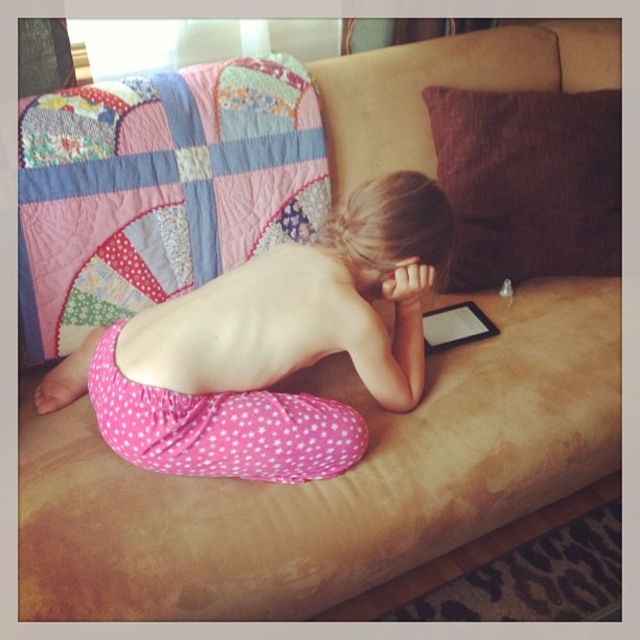
You are a furniture designer who wants to place a new decorative item between the brown cotton pillow at upper right and the pink polka dot fabric at lower center. Based on their sizes, which object should the item be placed closer to?

The brown cotton pillow at upper right is taller than the pink polka dot fabric at lower center. Therefore, the decorative item should be placed closer to the pink polka dot fabric at lower center to balance the height difference between the two objects.

The child is sitting on the couch with the pink polka dot pants at center and the black matte tablet at center. If the child wants to place the tablet on their lap without moving their legs, will there be enough space?

The pink polka dot pants at center might be wider than the black matte tablet at center, so there may not be enough space to place the tablet on the lap without moving the legs.

You are designing a seating arrangement and need to place a decorative pillow and a fabric decoration. The brown cotton pillow at upper right and the pink polka dot fabric at lower center are available. Which item has a greater thickness?

The brown cotton pillow at upper right is thinner than the pink polka dot fabric at lower center, so the pink polka dot fabric at lower center has greater thickness.